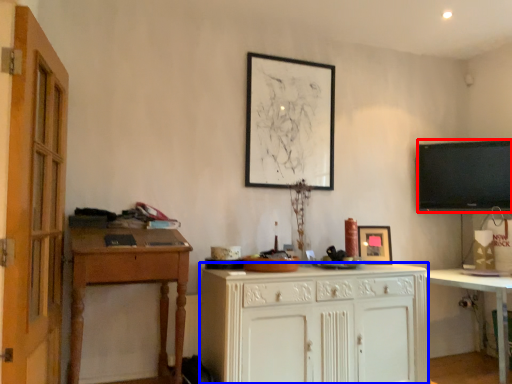
Question: Which object is further to the camera taking this photo, television (highlighted by a red box) or cabinetry (highlighted by a blue box)?

Choices:
 (A) television
 (B) cabinetry

Answer: (A)